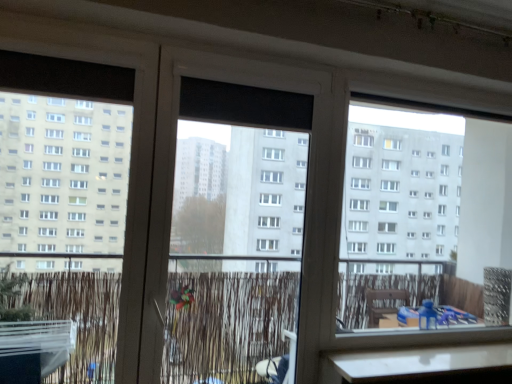
Measure the distance between transparent plastic screen door at center and camera.

The distance of transparent plastic screen door at center from camera is 1.84 meters.

In order to click on transparent plastic screen door at center in this screenshot , I will do `click(308, 174)`.

What is the approximate height of transparent plastic screen door at center?

The height of transparent plastic screen door at center is 4.99 feet.

The image size is (512, 384). Describe the element at coordinates (308, 174) in the screenshot. I see `transparent plastic screen door at center` at that location.

The width and height of the screenshot is (512, 384). Describe the element at coordinates (244, 105) in the screenshot. I see `black matte window screen at center` at that location.

In order to click on black matte window screen at center in this screenshot , I will do `click(244, 105)`.

The height and width of the screenshot is (384, 512). I want to click on transparent plastic screen door at center, so click(308, 174).

Considering the positions of objects black matte window screen at center and transparent plastic screen door at center in the image provided, who is more to the right, black matte window screen at center or transparent plastic screen door at center?

black matte window screen at center.

Which is in front, black matte window screen at center or transparent plastic screen door at center?

transparent plastic screen door at center.

Is point (305, 114) positioned after point (185, 67)?

Yes.

From the image's perspective, which is below, black matte window screen at center or transparent plastic screen door at center?

transparent plastic screen door at center.

From a real-world perspective, is black matte window screen at center physically located above or below transparent plastic screen door at center?

From a real-world perspective, black matte window screen at center is physically above transparent plastic screen door at center.

Which of these two, black matte window screen at center or transparent plastic screen door at center, is thinner?

black matte window screen at center.

Is black matte window screen at center taller than transparent plastic screen door at center?

In fact, black matte window screen at center may be shorter than transparent plastic screen door at center.

Is black matte window screen at center smaller than transparent plastic screen door at center?

Yes, black matte window screen at center is smaller than transparent plastic screen door at center.

Looking at this image, would you say black matte window screen at center is outside transparent plastic screen door at center?

No, black matte window screen at center is not outside of transparent plastic screen door at center.

Is black matte window screen at center placed right next to transparent plastic screen door at center?

black matte window screen at center and transparent plastic screen door at center are not in contact.

Is black matte window screen at center positioned with its back to transparent plastic screen door at center?

Yes, black matte window screen at center's orientation is away from transparent plastic screen door at center.

Looking at this image, how different are the orientations of black matte window screen at center and transparent plastic screen door at center in degrees?

The angle between the facing direction of black matte window screen at center and the facing direction of transparent plastic screen door at center is 1.64 degrees.

Looking at this image, how far apart are black matte window screen at center and transparent plastic screen door at center?

5.49 inches.

You are a GUI agent. You are given a task and a screenshot of the screen. Output one action in this format:
    pyautogui.click(x=<x>, y=<y>)
    Task: Click on the screen door that appears on the left of black matte window screen at center
    
    Given the screenshot: What is the action you would take?
    pyautogui.click(x=308, y=174)

Which object is positioned more to the left, transparent plastic screen door at center or black matte window screen at center?

transparent plastic screen door at center is more to the left.

Is transparent plastic screen door at center positioned in front of black matte window screen at center?

Yes, transparent plastic screen door at center is closer to the camera.

Is point (302, 130) positioned after point (214, 92)?

Yes, it is.

From the image's perspective, does transparent plastic screen door at center appear lower than black matte window screen at center?

Yes, from the image's perspective, transparent plastic screen door at center is below black matte window screen at center.

From a real-world perspective, which object stands above the other?

In real-world perspective, black matte window screen at center is above.

Between transparent plastic screen door at center and black matte window screen at center, which one has smaller width?

black matte window screen at center.

Can you confirm if transparent plastic screen door at center is taller than black matte window screen at center?

Correct, transparent plastic screen door at center is much taller as black matte window screen at center.

Who is smaller, transparent plastic screen door at center or black matte window screen at center?

black matte window screen at center.

Is transparent plastic screen door at center located outside black matte window screen at center?

transparent plastic screen door at center is positioned outside black matte window screen at center.

Is transparent plastic screen door at center beside black matte window screen at center?

transparent plastic screen door at center and black matte window screen at center are not in contact.

Is transparent plastic screen door at center looking in the opposite direction of black matte window screen at center?

Yes, transparent plastic screen door at center is positioned with its back facing black matte window screen at center.

How many degrees apart are the facing directions of transparent plastic screen door at center and black matte window screen at center?

There is a 1.64-degree angle between the facing directions of transparent plastic screen door at center and black matte window screen at center.

In the image, there is a black matte window screen at center. Where is `screen door below it (from the image's perspective)`? screen door below it (from the image's perspective) is located at coordinates (308, 174).

Identify the location of window screen that appears behind the transparent plastic screen door at center. This screenshot has width=512, height=384. (244, 105).

Identify the location of screen door below the black matte window screen at center (from a real-world perspective). This screenshot has height=384, width=512. (308, 174).